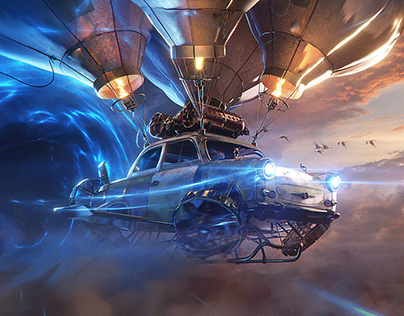
This screenshot has width=404, height=316. I want to click on balloon light, so click(201, 63).